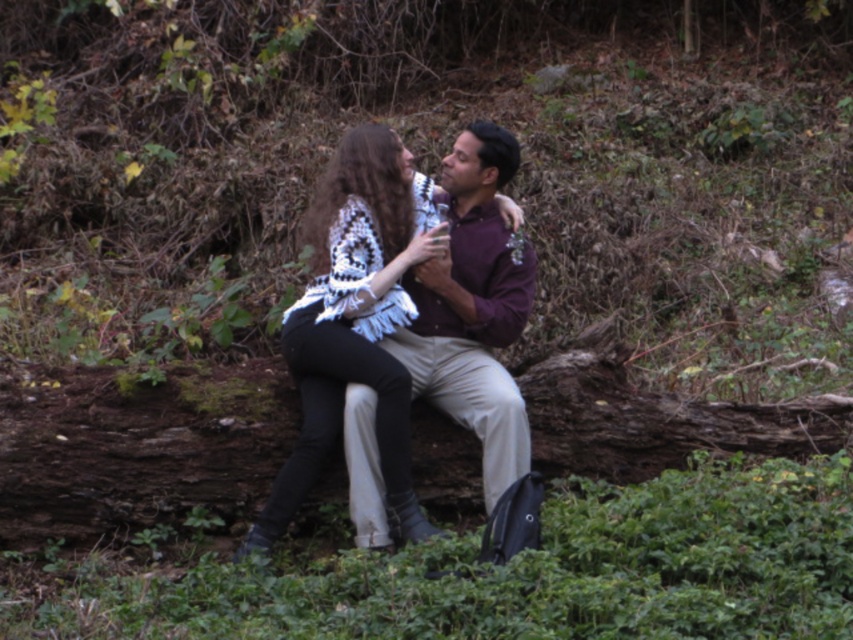
You are a photographer trying to capture a closeup shot of both the white crochet sweater at center and the purple matte shirt at center in the scene. Given that your camera lens has a maximum focus range of 10 inches, will you be able to clearly capture both subjects in focus without adjusting their positions?

The distance between the white crochet sweater at center and the purple matte shirt at center is 10.17 inches. Since the camera lens has a maximum focus range of 10 inches, the distance between them exceeds the lens capability. Therefore, the photographer will not be able to capture both subjects in focus without adjusting their positions.

Based on the photo, you are a photographer trying to capture a closeup of the two people in the image. Since you want to focus on their faces, you need to adjust your camera to ensure that the white crochet sweater at center and the purple matte shirt at center do not block the view. Which clothing item might you need to move slightly to avoid covering their faces, and why?

The white crochet sweater at center has a greater height compared to the purple matte shirt at center, so you should adjust the white crochet sweater at center to avoid it blocking the faces since it is taller.

You are a photographer trying to capture a candid shot of the two people sitting on the log. You want to ensure that both the white crochet sweater at center and the purple matte shirt at center are clearly visible in the frame. Based on their positions, which direction should you position yourself relative to the subjects to best capture both items in the shot?

Since the white crochet sweater at center is to the left of the purple matte shirt at center, positioning yourself to the right side of the subjects would allow you to capture both items in the frame as they spread out towards your left.